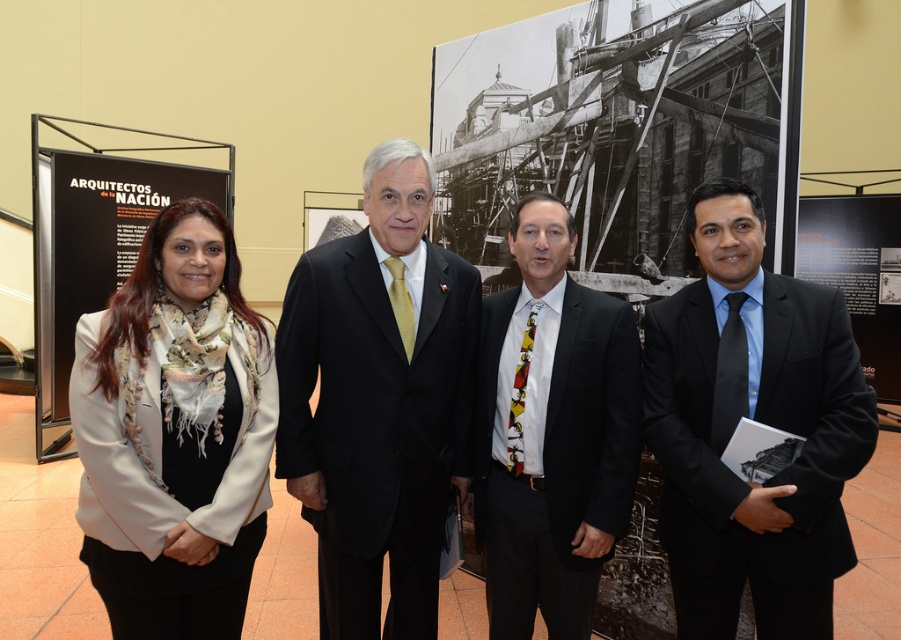
Question: Does black suit at right appear over white fabric at upper left?

Choices:
 (A) no
 (B) yes

Answer: (A)

Question: Which point is farther to the camera?

Choices:
 (A) black satin suit at center
 (B) white fabric at upper left
 (C) black silk suit at center

Answer: (B)

Question: Estimate the real-world distances between objects in this image. Which object is closer to the white fabric at upper left?

Choices:
 (A) white textured scarf at left
 (B) black suit at right

Answer: (A)

Question: Is black satin suit at center bigger than white fabric at upper left?

Choices:
 (A) no
 (B) yes

Answer: (A)

Question: In this image, where is white textured scarf at left located relative to white fabric at upper left?

Choices:
 (A) below
 (B) above

Answer: (A)

Question: Which of the following is the closest to the observer?

Choices:
 (A) black silk suit at center
 (B) white textured scarf at left
 (C) black suit at right
 (D) black satin suit at center

Answer: (B)